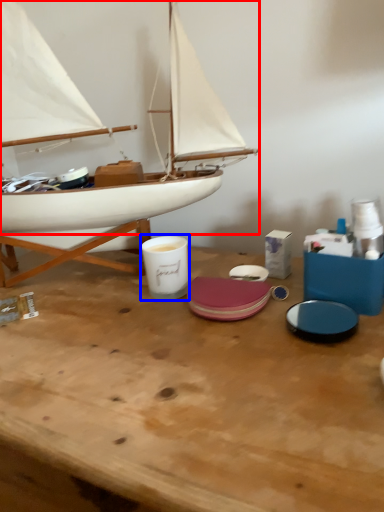
Question: Which object is further to the camera taking this photo, boat (highlighted by a red box) or tableware (highlighted by a blue box)?

Choices:
 (A) boat
 (B) tableware

Answer: (B)